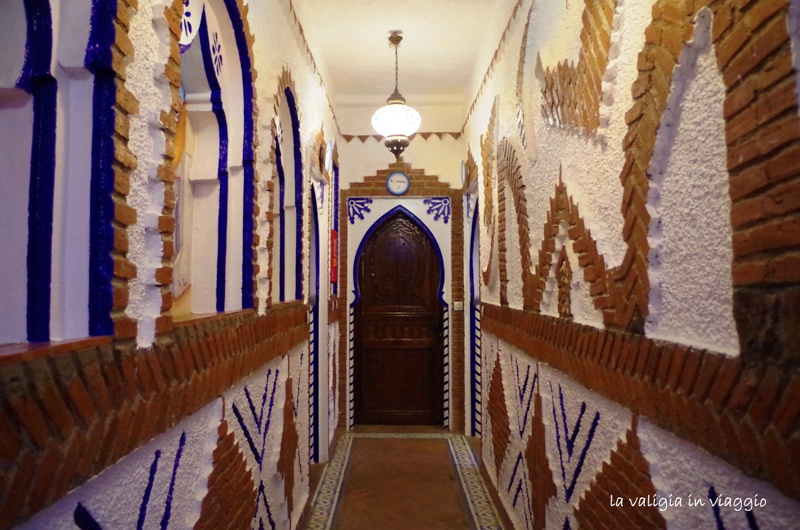
Image resolution: width=800 pixels, height=530 pixels. What are the coordinates of `white wall` in the screenshot? It's located at (692, 297), (706, 170), (602, 176), (554, 149), (620, 84).